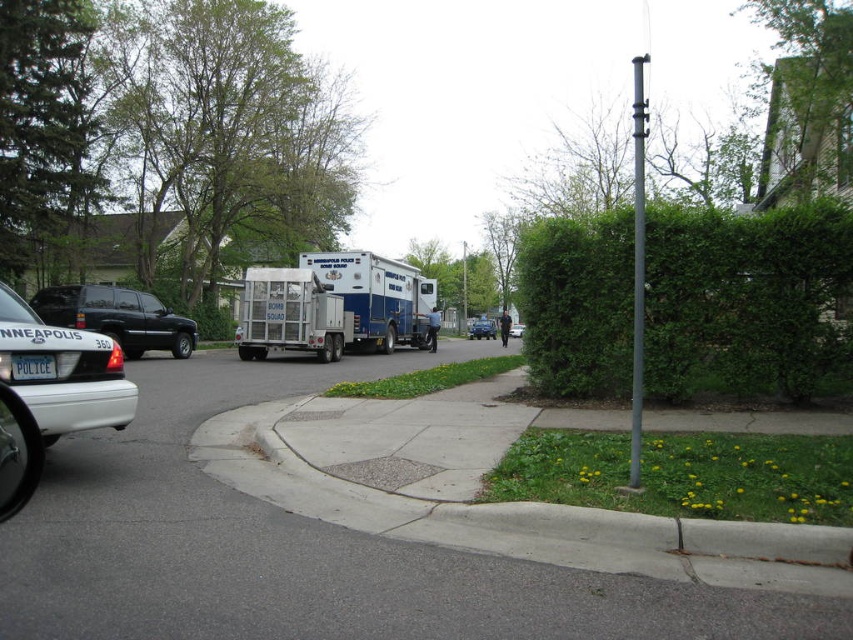
You are standing at the point marked by coordinates point (x=300, y=552) in the image. What surface are you standing on?

You are standing on the gray asphalt pavement at center, as the coordinates point (x=300, y=552) corresponds to that surface.